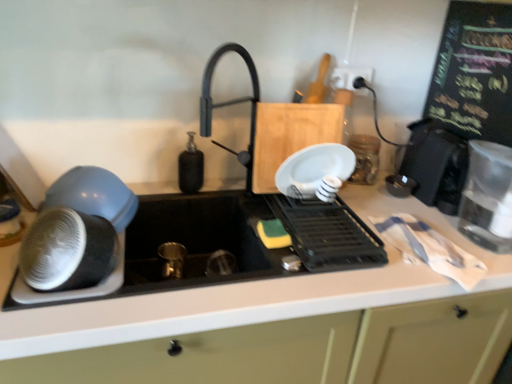
Locate an element on the screen. free space in front of clear glass water at right, the 2th kitchen appliance positioned from the left is located at coordinates click(x=474, y=272).